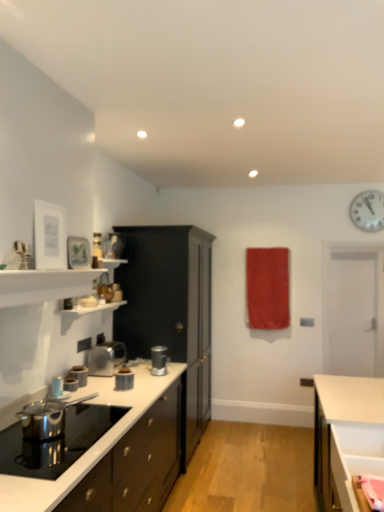
Locate an element on the screen. This screenshot has height=512, width=384. free space above matte red curtain at center (from a real-world perspective) is located at coordinates (265, 247).